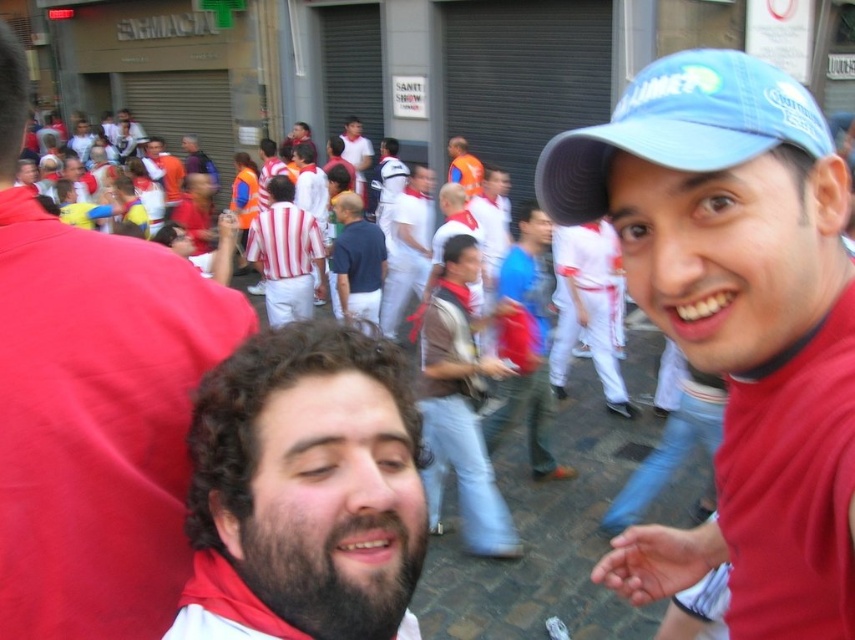
Does blue fabric cap at upper right have a smaller size compared to striped fabric shirt at center?

Yes.

Is blue fabric cap at upper right positioned behind striped fabric shirt at center?

No.

Is point (708, 109) positioned in front of point (282, 307)?

Yes, point (708, 109) is in front of point (282, 307).

Identify the location of blue fabric cap at upper right. (681, 128).

Which of these two, white striped shirt at center or orange reflective vest at center, stands shorter?

Standing shorter between the two is orange reflective vest at center.

Who is lower down, white striped shirt at center or orange reflective vest at center?

Positioned lower is white striped shirt at center.

Between point (408, 211) and point (458, 134), which one is positioned in front?

Point (408, 211) is more forward.

Locate an element on the screen. The height and width of the screenshot is (640, 855). white striped shirt at center is located at coordinates (407, 248).

Can you confirm if white striped shirt at center is wider than blue shirt at center?

Correct, the width of white striped shirt at center exceeds that of blue shirt at center.

Does white striped shirt at center come in front of blue shirt at center?

No, it is not.

The width and height of the screenshot is (855, 640). Find the location of `white striped shirt at center`. white striped shirt at center is located at coordinates (407, 248).